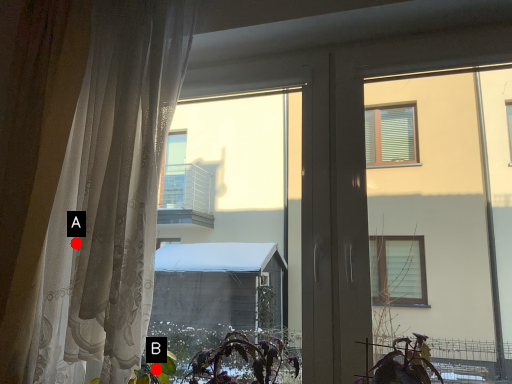
Question: Two points are circled on the image, labeled by A and B beside each circle. Which point is closer to the camera?

Choices:
 (A) A is closer
 (B) B is closer

Answer: (A)